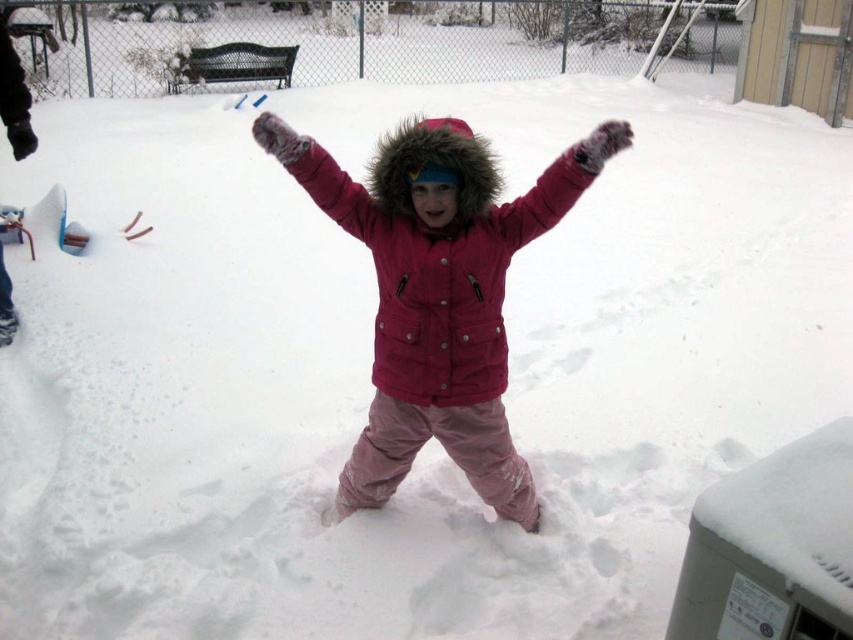
You are a photographer trying to capture the child in the winter scene. You want to ensure that both the fuzzy pink glove at center and the fuzzy pink arm at center are clearly visible in your shot. Which object should you focus on to ensure proper framing, considering their sizes?

The fuzzy pink glove at center has a lesser width compared to the fuzzy pink arm at center, so you should focus on the fuzzy pink arm at center to ensure proper framing since it is larger and more prominent.

You are a parent trying to ensure your child stays warm in the cold. Looking at the image, can you tell if the fuzzy pink arm at center is covered by the matte pink snowsuit at center?

The matte pink snowsuit at center is positioned under fuzzy pink arm at center, so the arm is not fully covered by the snowsuit. This means the fuzzy pink arm at center is exposed and may not be as protected from the cold as desired.

You are a photographer trying to capture the child in the winter scene. You need to ensure the matte pink snowsuit at center and the fuzzy pink arm at center are both visible in the frame. Given their sizes, which object should you focus on to ensure both are in focus?

The matte pink snowsuit at center has a larger size compared to fuzzy pink arm at center, so focusing on the larger matte pink snowsuit at center will help ensure both objects are in focus.